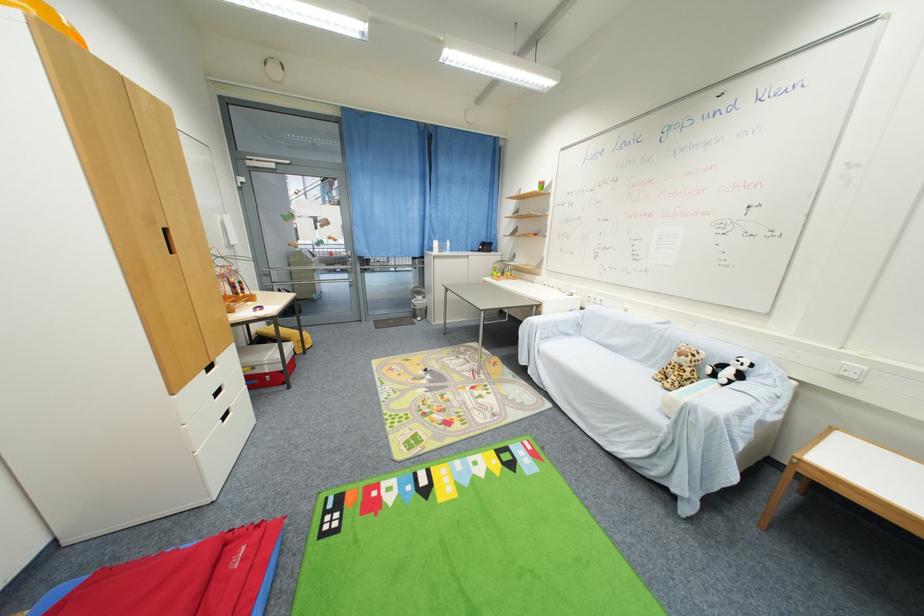
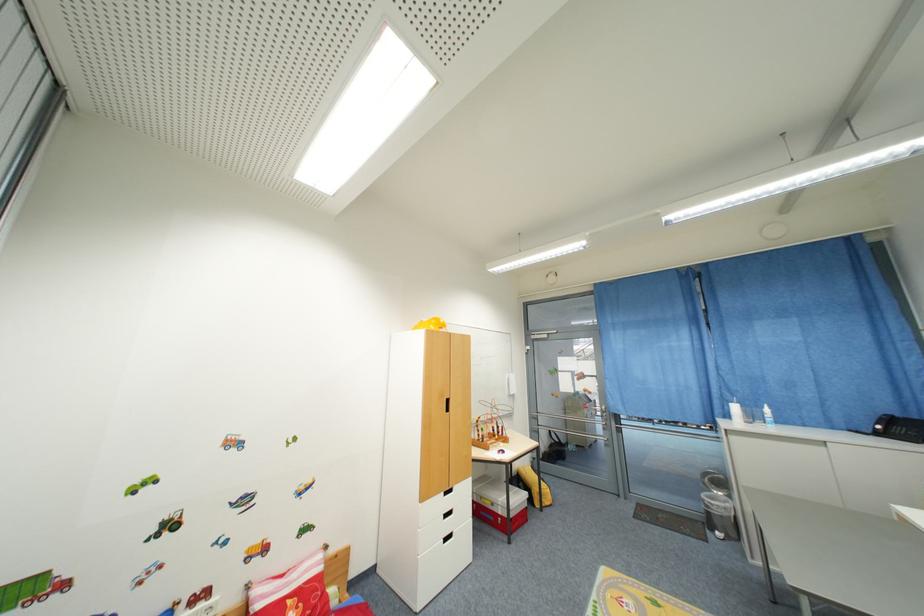
The point at [242,296] is marked in the first image. Where is the corresponding point in the second image?

(500, 438)